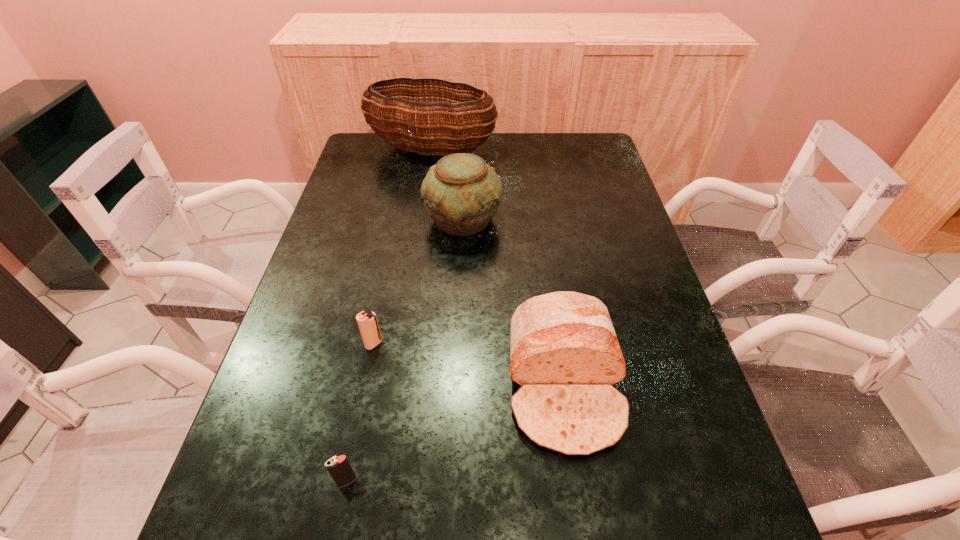
Identify the location of blank region between the bread and the farthest object. The height and width of the screenshot is (540, 960). (498, 267).

Where is `empty location between the farthest object and the nearest object`? empty location between the farthest object and the nearest object is located at coordinates (390, 315).

Locate an element on the screen. free space between the basket and the farther igniter is located at coordinates (403, 247).

You are a GUI agent. You are given a task and a screenshot of the screen. Output one action in this format:
    pyautogui.click(x=<x>, y=<y>)
    Task: Click on the free point between the nearer igniter and the second tallest object
    This screenshot has height=540, width=960.
    Given the screenshot: What is the action you would take?
    pyautogui.click(x=405, y=350)

You are a GUI agent. You are given a task and a screenshot of the screen. Output one action in this format:
    pyautogui.click(x=<x>, y=<y>)
    Task: Click on the vacant space that's between the second farthest object and the third tallest object
    The image size is (960, 540).
    Given the screenshot: What is the action you would take?
    pyautogui.click(x=514, y=301)

Find the location of `empty space between the nearest object and the second farthest object`. empty space between the nearest object and the second farthest object is located at coordinates (405, 350).

Locate an element on the screen. unoccupied position between the farthest object and the nearer igniter is located at coordinates (390, 315).

Image resolution: width=960 pixels, height=540 pixels. In order to click on vacant area between the third shortest object and the nearest object in this screenshot , I will do `click(456, 433)`.

Locate an element on the screen. This screenshot has width=960, height=540. vacant area that lies between the third shortest object and the fourth nearest object is located at coordinates (514, 301).

You are a GUI agent. You are given a task and a screenshot of the screen. Output one action in this format:
    pyautogui.click(x=<x>, y=<y>)
    Task: Click on the third closest object to the bread
    The width and height of the screenshot is (960, 540).
    Given the screenshot: What is the action you would take?
    (x=339, y=467)